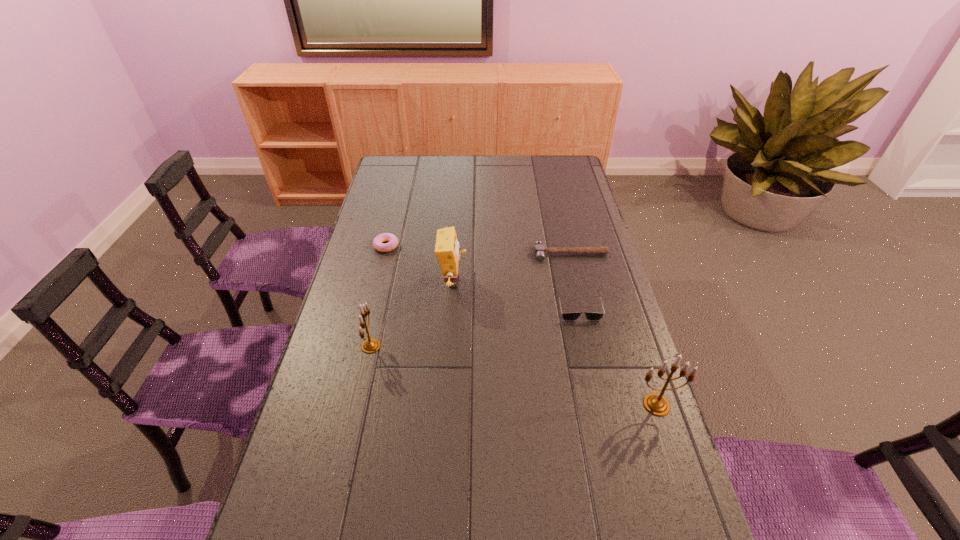
Identify the location of vacant area in the image that satisfies the following two spatial constraints: 1. on the striking face of the nearest object; 2. on the left side of the hammer. The height and width of the screenshot is (540, 960). (606, 404).

Find the location of a particular element. The image size is (960, 540). blank area in the image that satisfies the following two spatial constraints: 1. on the front-facing side of the nearest object; 2. on the left side of the sunglasses is located at coordinates (600, 404).